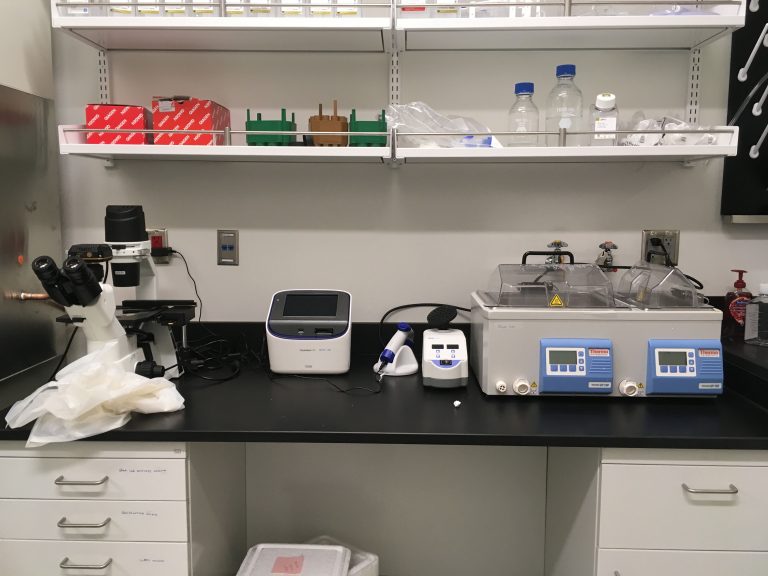
Locate an element on the screen. This screenshot has width=768, height=576. 4th shelf is located at coordinates pyautogui.click(x=530, y=151).